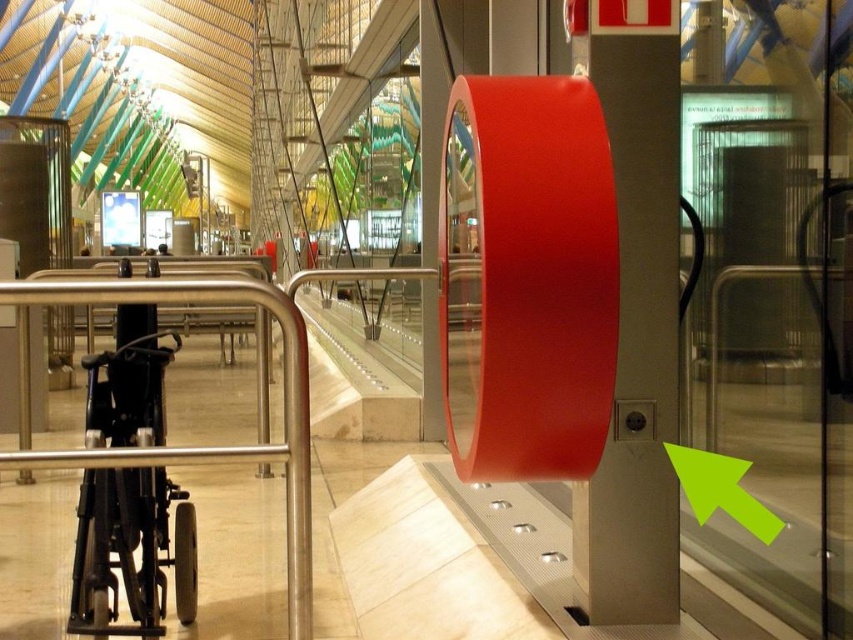
Consider the image. You are a person in a wheelchair navigating through the transportation hub. You see the black plastic wheelchair at left and the satin silver rail at center. Which object is closer to you as you approach the entrance?

The black plastic wheelchair at left is closer to you than the satin silver rail at center because it is further to the viewer.